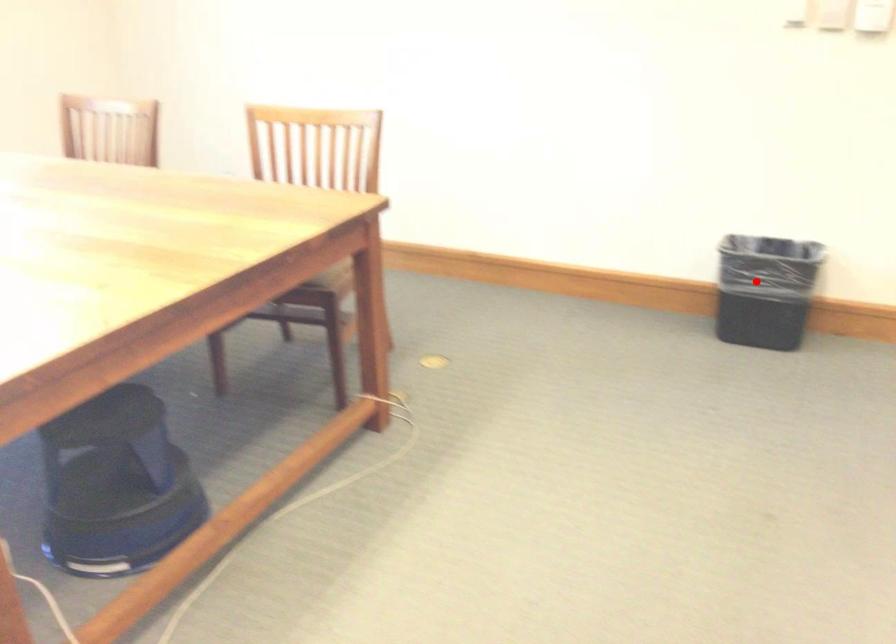
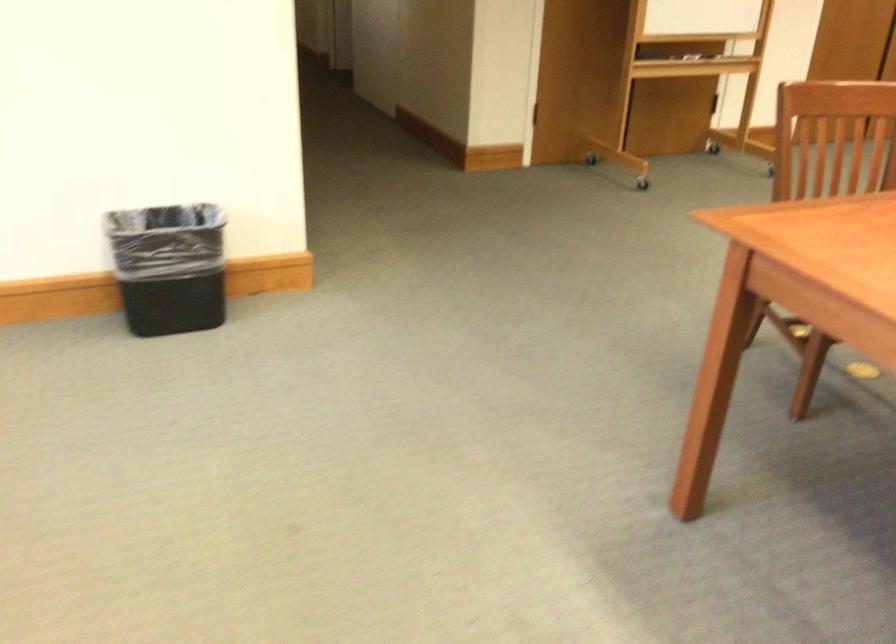
Question: I am providing you with two images of the same scene from different viewpoints. A red point is shown in image1. For the corresponding object point in image2, is it positioned nearer or farther from the camera?

Choices:
 (A) Nearer
 (B) Farther

Answer: (A)